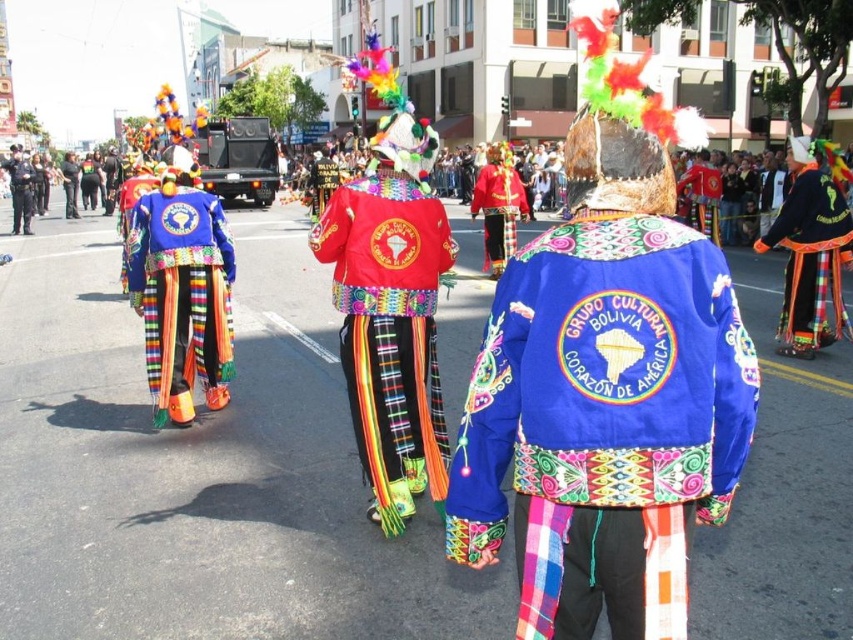
You are a photographer standing at the center of the parade. You notice a point at coordinates point (390, 332). Which object is this point located on?

The point (390, 332) is located on the red velvet jacket at center.

You are a photographer standing at the origin point of the image. You want to capture a photo of the red velvet jacket at center. What are the coordinates where you should aim your camera?

The coordinates to aim your camera are at point (390, 332) where the red velvet jacket at center is located.

You are a photographer at the parade and want to take a photo that includes both point (x=364, y=259) and point (x=485, y=173). Since you want the closer one to be in focus, which point should you focus on?

Point (x=364, y=259) is closer to the camera than point (x=485, y=173), so you should focus on point (x=364, y=259) to ensure it is in focus.